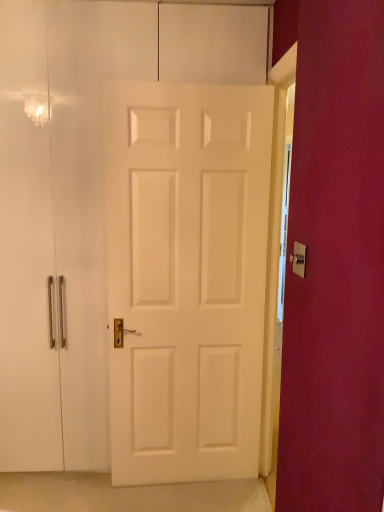
Question: Considering their positions, is gold metallic door handle at center located in front of or behind white matte door at center?

Choices:
 (A) behind
 (B) front

Answer: (B)

Question: Is gold metallic door handle at center inside or outside of white matte door at center?

Choices:
 (A) inside
 (B) outside

Answer: (B)

Question: Looking at the image, does gold metallic door handle at center seem bigger or smaller compared to white matte door at center?

Choices:
 (A) big
 (B) small

Answer: (B)

Question: From the image's perspective, is white matte door at center located above or below gold metallic door handle at center?

Choices:
 (A) above
 (B) below

Answer: (B)

Question: Choose the correct answer: Is white matte door at center inside gold metallic door handle at center or outside it?

Choices:
 (A) outside
 (B) inside

Answer: (A)

Question: From a real-world perspective, is white matte door at center above or below gold metallic door handle at center?

Choices:
 (A) above
 (B) below

Answer: (B)

Question: Is point (187, 236) positioned closer to the camera than point (296, 269)?

Choices:
 (A) closer
 (B) farther

Answer: (B)